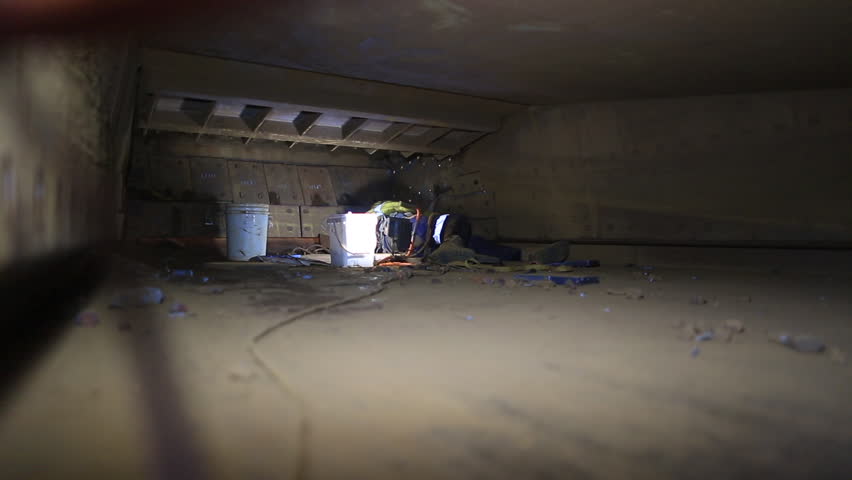
The width and height of the screenshot is (852, 480). I want to click on light source, so click(366, 234), click(435, 226).